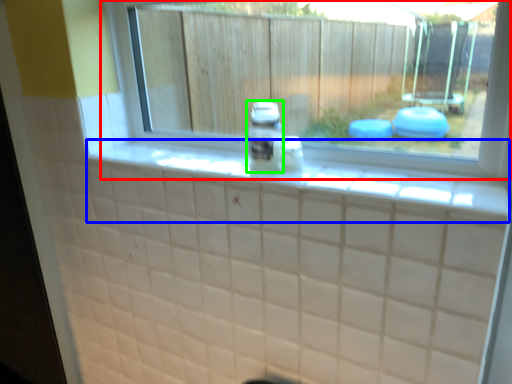
Question: Estimate the real-world distances between objects in this image. Which object is farther from window (highlighted by a red box), ledge (highlighted by a blue box) or glass jar (highlighted by a green box)?

Choices:
 (A) ledge
 (B) glass jar

Answer: (A)